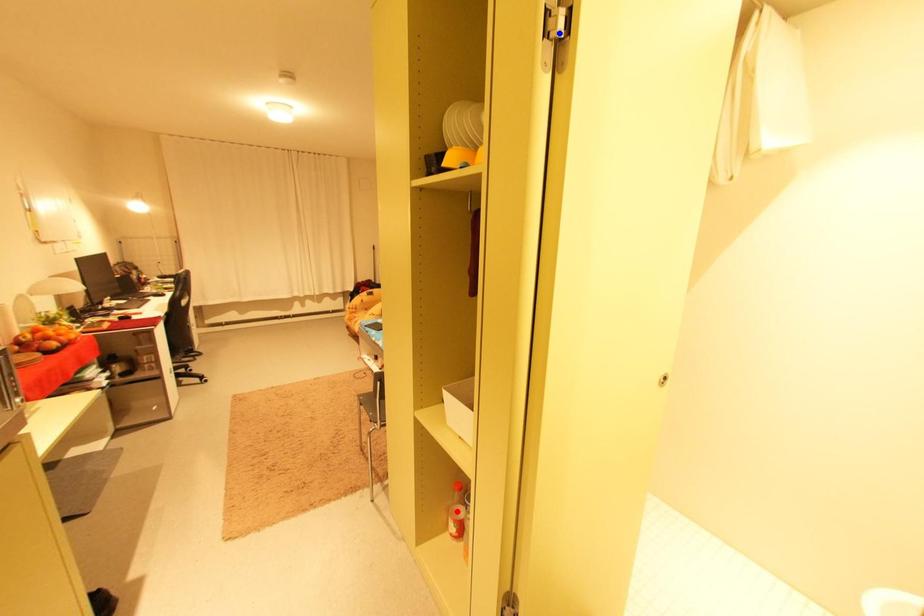
Question: Which of the two points in the image is closer to the camera?

Choices:
 (A) Blue point is closer.
 (B) Red point is closer.

Answer: (A)